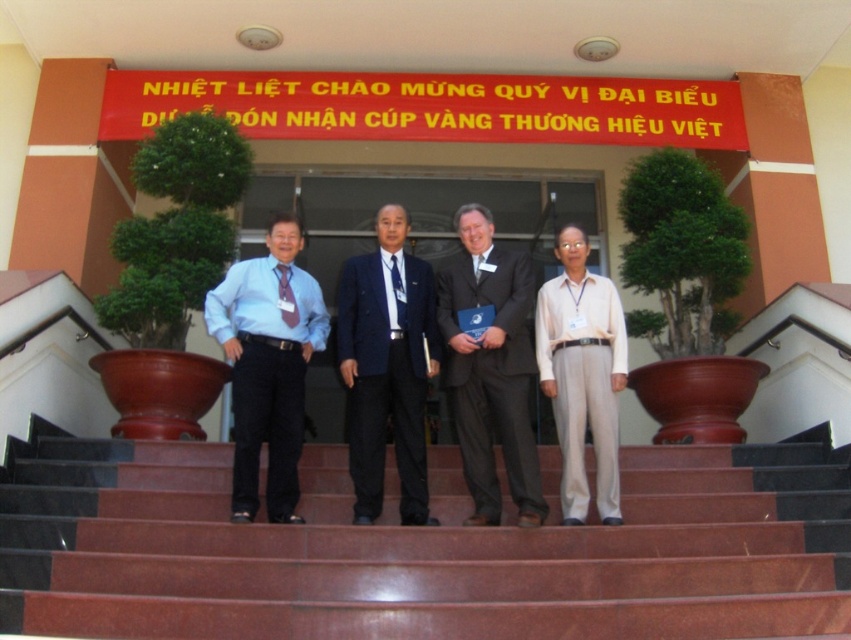
Based on the scene description, which object is positioned higher between the dark gray suit at center and the matte blue shirt at center?

The dark gray suit at center is positioned higher than the matte blue shirt at center according to the description.

Based on the scene description, which object is wider, the navy blue wool suit at center or the beige cotton pants at center?

The navy blue wool suit at center is wider than the beige cotton pants at center according to the description.